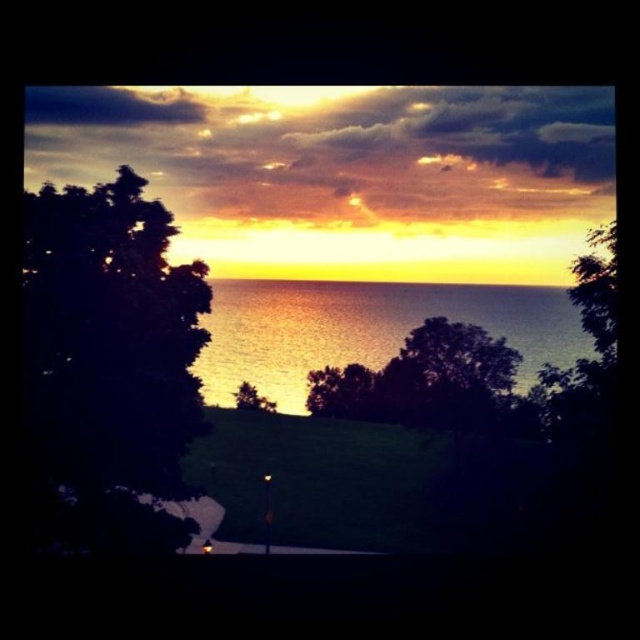
Question: Considering the real-world distances, which object is farthest from the shiny metallic water at center?

Choices:
 (A) dark green leafy tree at left
 (B) green leafy tree at center

Answer: (A)

Question: Which object is the farthest from the dark green leafy tree at left?

Choices:
 (A) green leafy tree at center
 (B) shiny metallic water at center

Answer: (A)

Question: Which point is farther from the camera taking this photo?

Choices:
 (A) (246, 406)
 (B) (100, 314)
 (C) (566, 340)

Answer: (A)

Question: Does dark green leafy tree at left have a lesser width compared to green leafy tree at center?

Choices:
 (A) yes
 (B) no

Answer: (B)

Question: Does dark green leafy tree at left have a smaller size compared to shiny metallic water at center?

Choices:
 (A) no
 (B) yes

Answer: (A)

Question: In this image, where is dark green leafy tree at left located relative to shiny metallic water at center?

Choices:
 (A) right
 (B) left

Answer: (B)